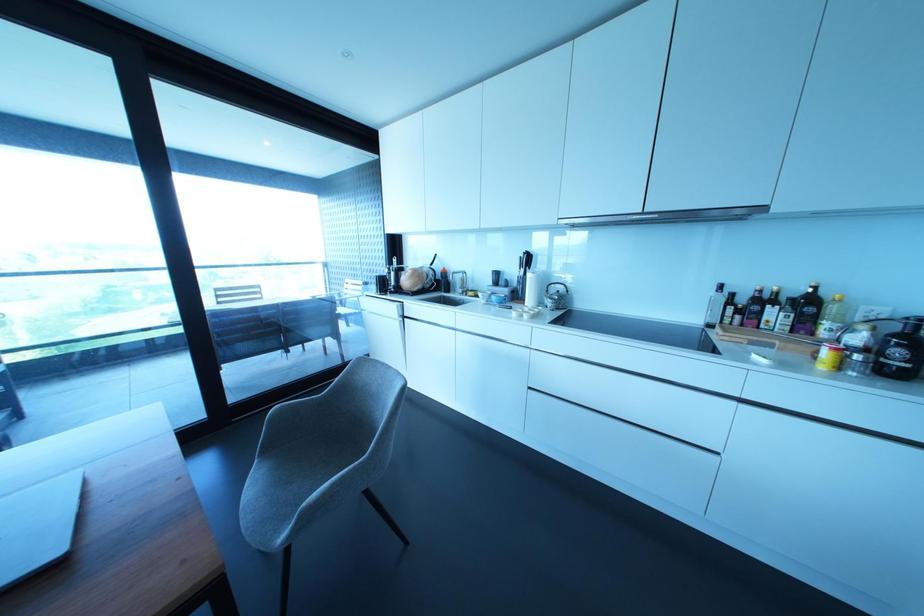
The width and height of the screenshot is (924, 616). What are the coordinates of `black knife handle` in the screenshot? It's located at (527, 259).